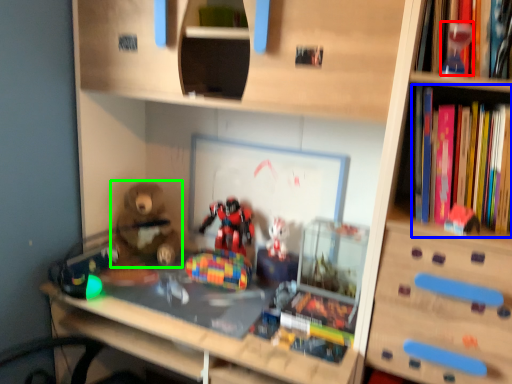
Question: Considering the real-world distances, which object is closest to toy (highlighted by a red box)? book (highlighted by a blue box) or toy (highlighted by a green box).

Choices:
 (A) book
 (B) toy

Answer: (A)